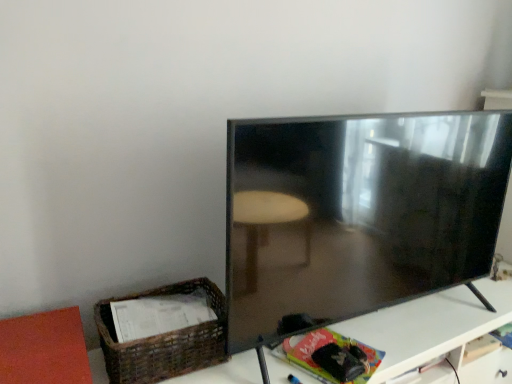
Question: From the image's perspective, is white glossy table at lower right located above or below matte black tv at right?

Choices:
 (A) below
 (B) above

Answer: (A)

Question: Does point (434, 317) appear closer or farther from the camera than point (387, 213)?

Choices:
 (A) farther
 (B) closer

Answer: (A)

Question: Which is nearer to the white glossy table at lower right?

Choices:
 (A) matte black tv at right
 (B) woven brown basket at lower left

Answer: (A)

Question: Estimate the real-world distances between objects in this image. Which object is farther from the matte black tv at right?

Choices:
 (A) white glossy table at lower right
 (B) woven brown basket at lower left

Answer: (B)